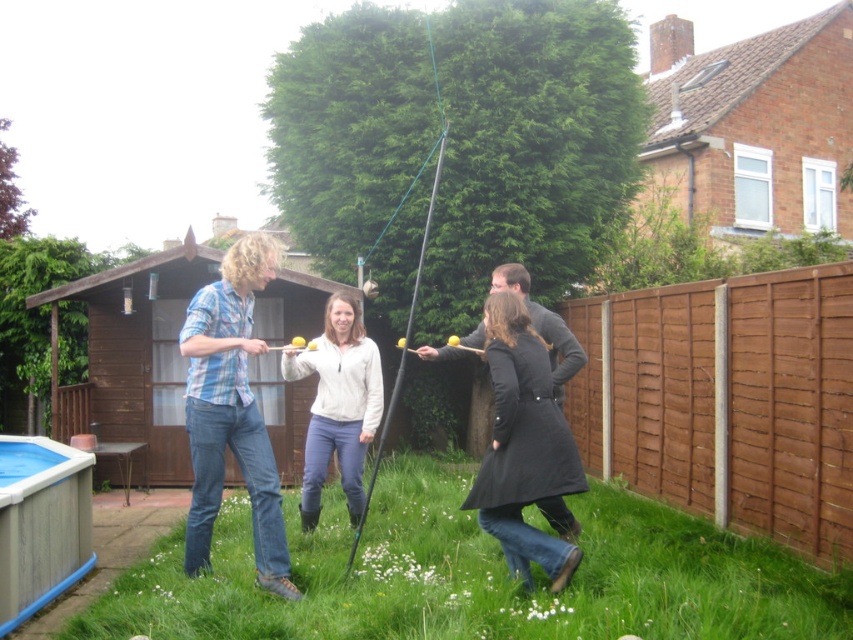
Question: Based on their relative distances, which object is farther from the white fleece jacket at center?

Choices:
 (A) dark gray sweater at center
 (B) blue plaid shirt at center
 (C) brown wooden fence at right

Answer: (C)

Question: Estimate the real-world distances between objects in this image. Which object is closer to the green grass at lower center?

Choices:
 (A) blue plaid shirt at center
 (B) black leather coat at center
 (C) brown wooden fence at right
 (D) white fleece jacket at center

Answer: (A)

Question: Is brown wooden fence at right bigger than black leather coat at center?

Choices:
 (A) yes
 (B) no

Answer: (A)

Question: Which point appears closest to the camera in this image?

Choices:
 (A) (289, 349)
 (B) (231, 449)
 (C) (502, 275)

Answer: (B)

Question: In this image, where is green grass at lower center located relative to dark gray sweater at center?

Choices:
 (A) right
 (B) left

Answer: (B)

Question: Is green grass at lower center further to the viewer compared to black leather coat at center?

Choices:
 (A) no
 (B) yes

Answer: (A)